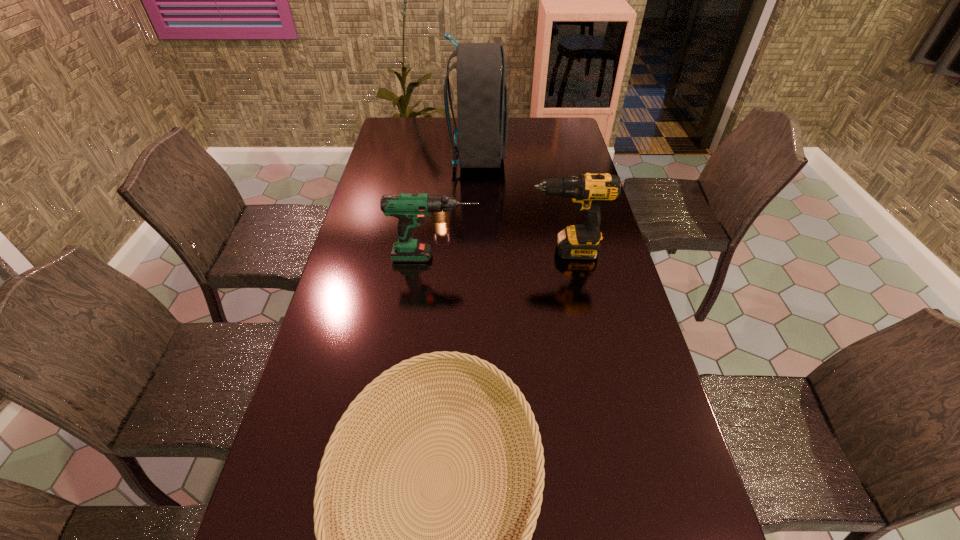
The height and width of the screenshot is (540, 960). Find the location of `backpack`. backpack is located at coordinates (482, 96).

Locate an element on the screen. This screenshot has height=540, width=960. the farthest object is located at coordinates (482, 96).

At what (x,y) coordinates should I click in order to perform the action: click on the right drill. Please return your answer as a coordinate pair (x, y). This screenshot has height=540, width=960. Looking at the image, I should click on (589, 191).

You are a GUI agent. You are given a task and a screenshot of the screen. Output one action in this format:
    pyautogui.click(x=<x>, y=<y>)
    Task: Click on the left drill
    The width and height of the screenshot is (960, 540).
    Given the screenshot: What is the action you would take?
    pyautogui.click(x=410, y=209)

The image size is (960, 540). I want to click on the third shortest object, so click(x=410, y=209).

Where is `the second farthest object`? the second farthest object is located at coordinates (437, 217).

The width and height of the screenshot is (960, 540). Find the location of `vacant space situated 0.210m on the front-facing side of the farthest object`. vacant space situated 0.210m on the front-facing side of the farthest object is located at coordinates (557, 157).

Where is `free point located at the tip of the right drill`? Image resolution: width=960 pixels, height=540 pixels. free point located at the tip of the right drill is located at coordinates (492, 251).

Find the location of a particular element. Image resolution: width=960 pixels, height=540 pixels. free space located at the tip of the right drill is located at coordinates 497,251.

You are a GUI agent. You are given a task and a screenshot of the screen. Output one action in this format:
    pyautogui.click(x=<x>, y=<y>)
    Task: Click on the free location located 0.080m at the tip of the right drill
    Image resolution: width=960 pixels, height=540 pixels.
    Given the screenshot: What is the action you would take?
    pyautogui.click(x=504, y=251)